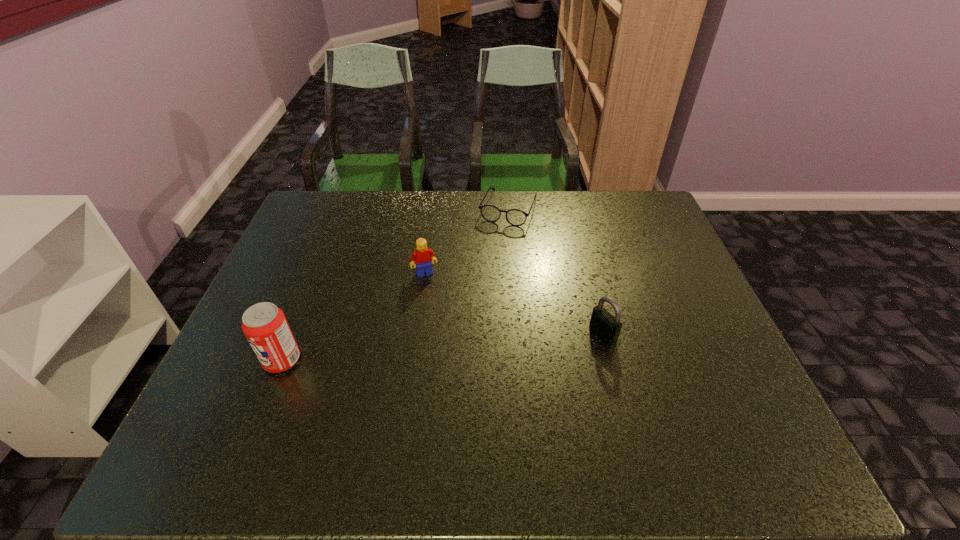
Identify the location of vacant area that lies between the shortest object and the rightmost object. The width and height of the screenshot is (960, 540). (556, 272).

Where is `vacant space in between the tallest object and the shortest object`? The height and width of the screenshot is (540, 960). vacant space in between the tallest object and the shortest object is located at coordinates [396, 285].

Identify the location of free space between the rightmost object and the third nearest object. (514, 303).

Identify the location of object that can be found as the third closest to the Lego. (605, 326).

The image size is (960, 540). I want to click on object that is the third closest to the shortest object, so click(265, 326).